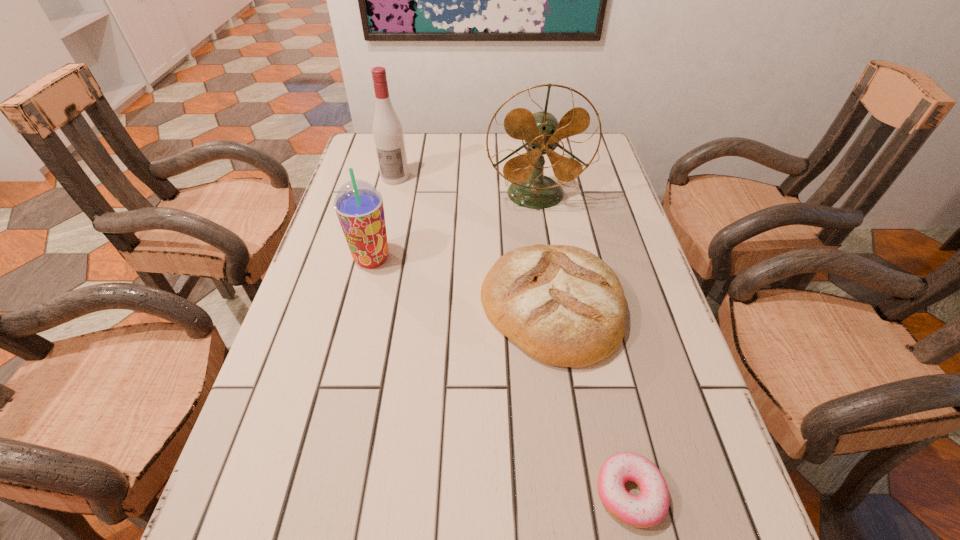
Identify the location of free space located 0.280m on the back of the nearest object. (592, 326).

This screenshot has width=960, height=540. I want to click on object at the far edge, so click(x=387, y=130).

Where is `alcohol present at the left edge`? alcohol present at the left edge is located at coordinates (387, 130).

Find the location of a particular element. smoothie that is at the left edge is located at coordinates (358, 204).

You are a GUI agent. You are given a task and a screenshot of the screen. Output one action in this format:
    pyautogui.click(x=<x>, y=<y>)
    Task: Click on the fan that is at the right edge
    
    Given the screenshot: What is the action you would take?
    pyautogui.click(x=530, y=188)

Locate an element on the screen. The height and width of the screenshot is (540, 960). bread positioned at the right edge is located at coordinates (564, 306).

Image resolution: width=960 pixels, height=540 pixels. I want to click on doughnut present at the right edge, so click(649, 508).

What are the coordinates of `object at the far left corner` in the screenshot? It's located at point(387,130).

Where is `vacant space at the far edge`? This screenshot has height=540, width=960. vacant space at the far edge is located at coordinates (468, 164).

Image resolution: width=960 pixels, height=540 pixels. In the image, there is a desktop. Identify the location of vacant space at the left edge. (303, 536).